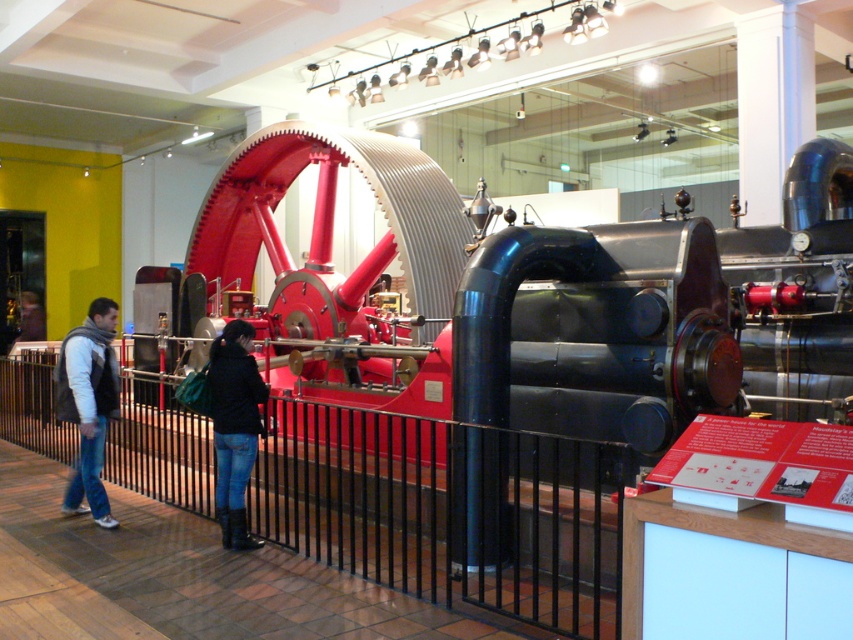
Can you confirm if red polished metal steam engine at center is positioned to the left of denim jacket at left?

In fact, red polished metal steam engine at center is to the right of denim jacket at left.

Looking at this image, can you confirm if red polished metal steam engine at center is bigger than denim jacket at left?

Yes.

Image resolution: width=853 pixels, height=640 pixels. I want to click on red polished metal steam engine at center, so click(543, 298).

Can you confirm if denim jacket at left is smaller than jeans at lower center?

Incorrect, denim jacket at left is not smaller in size than jeans at lower center.

Consider the image. Who is lower down, denim jacket at left or jeans at lower center?

denim jacket at left is below.

The height and width of the screenshot is (640, 853). In order to click on denim jacket at left in this screenshot , I will do (x=88, y=403).

Who is more forward, (556, 376) or (235, 355)?

Positioned in front is point (235, 355).

Measure the distance from red polished metal steam engine at center to jeans at lower center.

red polished metal steam engine at center is 10.40 feet away from jeans at lower center.

Does point (612, 266) come farther from viewer compared to point (242, 536)?

Yes, it is.

You are a GUI agent. You are given a task and a screenshot of the screen. Output one action in this format:
    pyautogui.click(x=<x>, y=<y>)
    Task: Click on the red polished metal steam engine at center
    This screenshot has height=640, width=853.
    Given the screenshot: What is the action you would take?
    pyautogui.click(x=543, y=298)